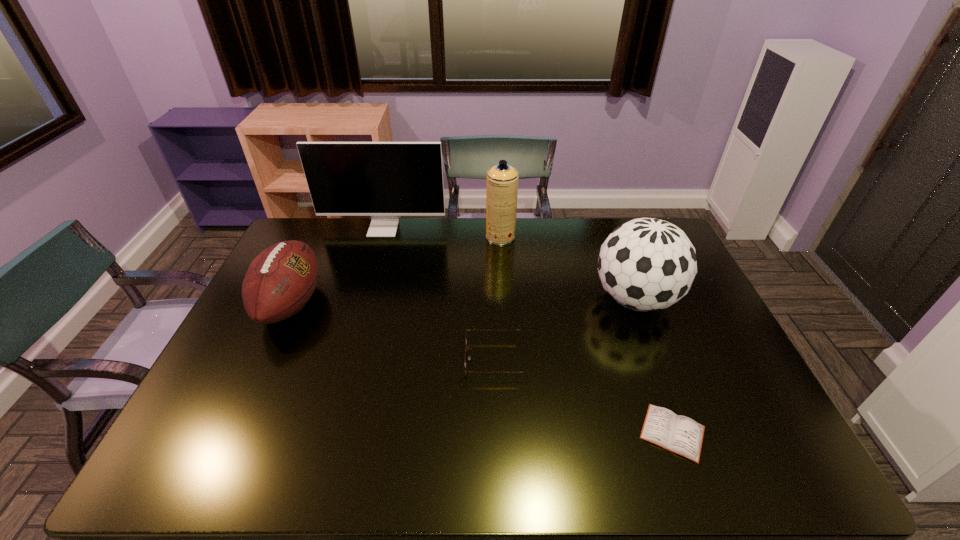
Locate an element on the screen. monitor is located at coordinates (384, 180).

I want to click on aerosol can, so click(x=502, y=180).

Find the location of `soccer ball`. soccer ball is located at coordinates (647, 264).

Identify the location of football (American). (279, 282).

Image resolution: width=960 pixels, height=540 pixels. I want to click on sunglasses, so click(x=469, y=356).

Locate an element on the screen. the shortest object is located at coordinates (679, 434).

The image size is (960, 540). In order to click on the nearest object in this screenshot , I will do `click(679, 434)`.

What are the coordinates of `vacant region located on the front-facing side of the monitor` in the screenshot? It's located at (377, 250).

Find the location of a particular element. Image resolution: width=960 pixels, height=540 pixels. vacant space located on the left of the aerosol can is located at coordinates (445, 237).

Find the location of a particular element. vacant region located 0.380m on the front of the soccer ball is located at coordinates (695, 455).